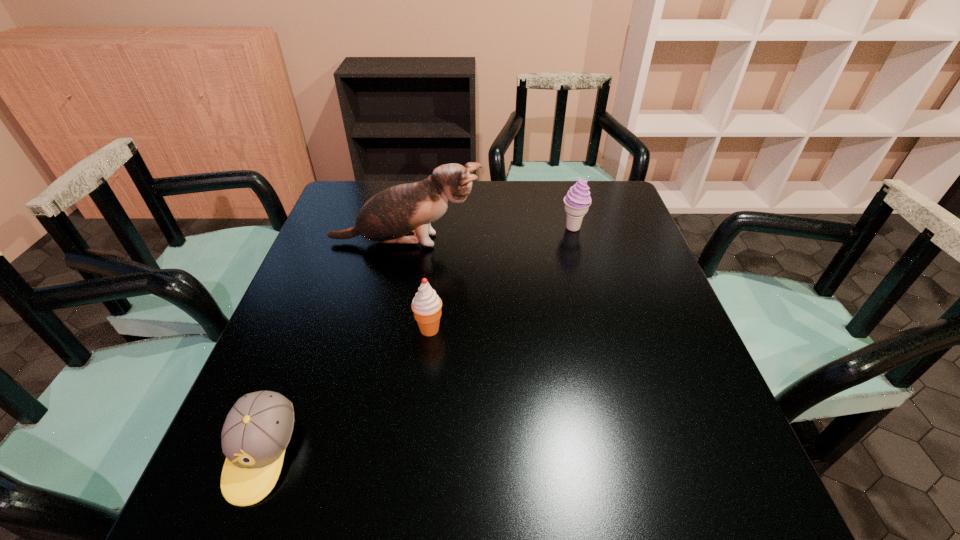
Locate an element on the screen. This screenshot has width=960, height=540. cat is located at coordinates (401, 214).

Locate an element on the screen. This screenshot has height=540, width=960. the right icecream is located at coordinates (577, 201).

This screenshot has width=960, height=540. I want to click on the farther icecream, so click(577, 201).

Where is `the left icecream`? The width and height of the screenshot is (960, 540). the left icecream is located at coordinates (426, 305).

Find the location of a particular element. Image resolution: width=960 pixels, height=540 pixels. the third farthest object is located at coordinates (426, 305).

At what (x,y) coordinates should I click in order to perform the action: click on baseball cap. Please return your answer as a coordinate pair (x, y). The image size is (960, 540). Looking at the image, I should click on (257, 430).

The width and height of the screenshot is (960, 540). Find the location of `the nearest object`. the nearest object is located at coordinates (257, 430).

Find the location of a particular element. Image resolution: width=960 pixels, height=540 pixels. vacant position located at the face of the cat is located at coordinates (507, 242).

In order to click on free space located on the front of the right icecream in this screenshot , I will do `click(593, 306)`.

Image resolution: width=960 pixels, height=540 pixels. Find the location of `vacant space located on the back of the second nearest object`. vacant space located on the back of the second nearest object is located at coordinates (438, 252).